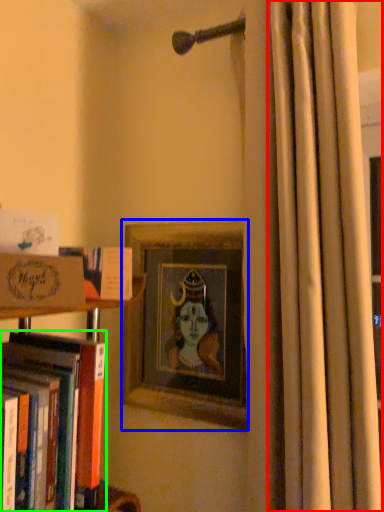
Question: Which object is the closest to the curtain (highlighted by a red box)? Choose among these: picture frame (highlighted by a blue box) or book (highlighted by a green box).

Choices:
 (A) picture frame
 (B) book

Answer: (A)